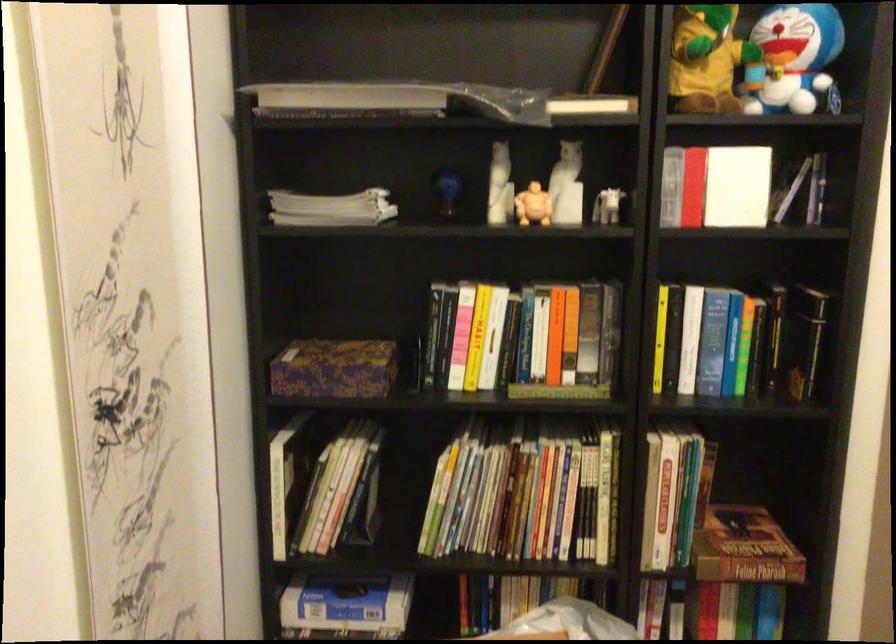
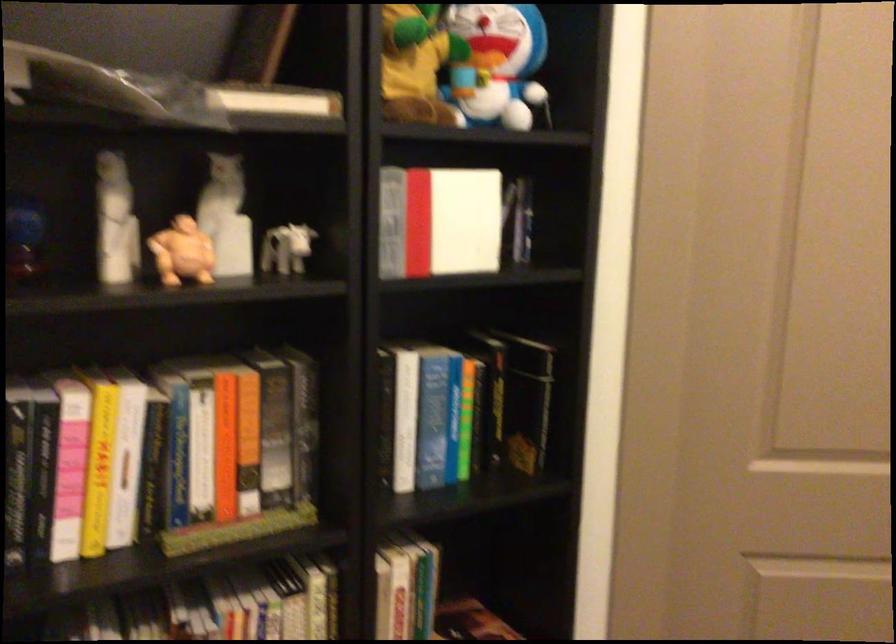
Question: The first image is from the beginning of the video and the second image is from the end. How did the camera likely rotate when shooting the video?

Choices:
 (A) Left
 (B) Right
 (C) Up
 (D) Down

Answer: (B)